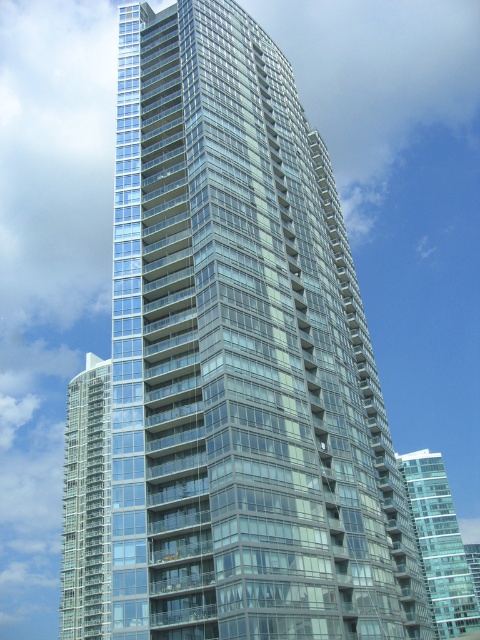
Can you confirm if transparent glass building at center is smaller than transparent glass building at right?

No, transparent glass building at center is not smaller than transparent glass building at right.

Is point (82, 401) positioned behind point (444, 612)?

No, (82, 401) is in front of (444, 612).

I want to click on transparent glass building at center, so click(x=86, y=506).